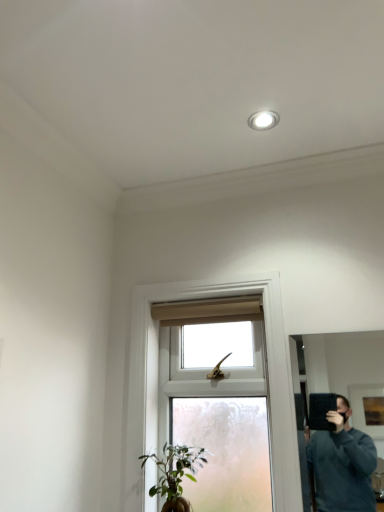
Question: Is the position of green matte plant at lower center less distant than that of white glossy recessed light at upper center?

Choices:
 (A) yes
 (B) no

Answer: (A)

Question: Does green matte plant at lower center turn towards white glossy recessed light at upper center?

Choices:
 (A) yes
 (B) no

Answer: (B)

Question: Is the depth of green matte plant at lower center greater than that of white glossy recessed light at upper center?

Choices:
 (A) no
 (B) yes

Answer: (A)

Question: Is green matte plant at lower center not close to white glossy recessed light at upper center?

Choices:
 (A) yes
 (B) no

Answer: (A)

Question: Is green matte plant at lower center thinner than white glossy recessed light at upper center?

Choices:
 (A) yes
 (B) no

Answer: (B)

Question: From the image's perspective, does green matte plant at lower center appear lower than white glossy recessed light at upper center?

Choices:
 (A) yes
 (B) no

Answer: (A)

Question: From a real-world perspective, is black matte mirror at right over clear glass window at center?

Choices:
 (A) yes
 (B) no

Answer: (B)

Question: Is black matte mirror at right smaller than clear glass window at center?

Choices:
 (A) no
 (B) yes

Answer: (B)

Question: Are black matte mirror at right and clear glass window at center located far from each other?

Choices:
 (A) no
 (B) yes

Answer: (B)

Question: From the image's perspective, is black matte mirror at right beneath clear glass window at center?

Choices:
 (A) yes
 (B) no

Answer: (A)

Question: Does black matte mirror at right have a greater height compared to clear glass window at center?

Choices:
 (A) no
 (B) yes

Answer: (A)

Question: Is black matte mirror at right surrounding clear glass window at center?

Choices:
 (A) yes
 (B) no

Answer: (B)

Question: Is white glossy recessed light at upper center bigger than clear glass window at center?

Choices:
 (A) no
 (B) yes

Answer: (A)